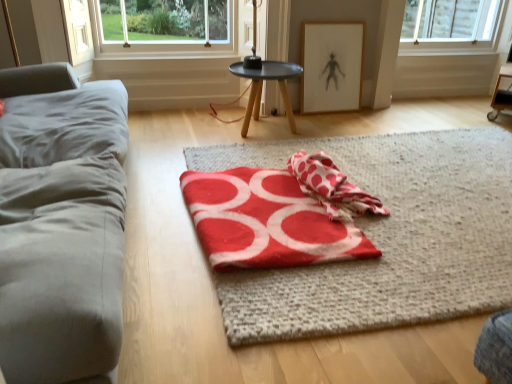
Question: From the image's perspective, relative to gray fabric couch at left, is red felt beach towel at center, which is the 2th beach towel in right-to-left order, above or below?

Choices:
 (A) below
 (B) above

Answer: (A)

Question: Does point (263, 213) appear closer or farther from the camera than point (67, 147)?

Choices:
 (A) closer
 (B) farther

Answer: (B)

Question: Based on their relative distances, which object is farther from the matte black table at center?

Choices:
 (A) gray fabric couch at left
 (B) red polka dot towel at center, which appears as the 1th beach towel when viewed from the right
 (C) red felt beach towel at center, which is the first beach towel in left-to-right order
 (D) red woolen blanket at center
 (E) wooden framed artwork at upper center

Answer: (A)

Question: Which object is the farthest from the matte black table at center?

Choices:
 (A) gray fabric couch at left
 (B) red felt beach towel at center, which is the first beach towel in left-to-right order
 (C) wooden framed artwork at upper center
 (D) red polka dot towel at center, the 2th beach towel when ordered from left to right
 (E) red woolen blanket at center

Answer: (A)